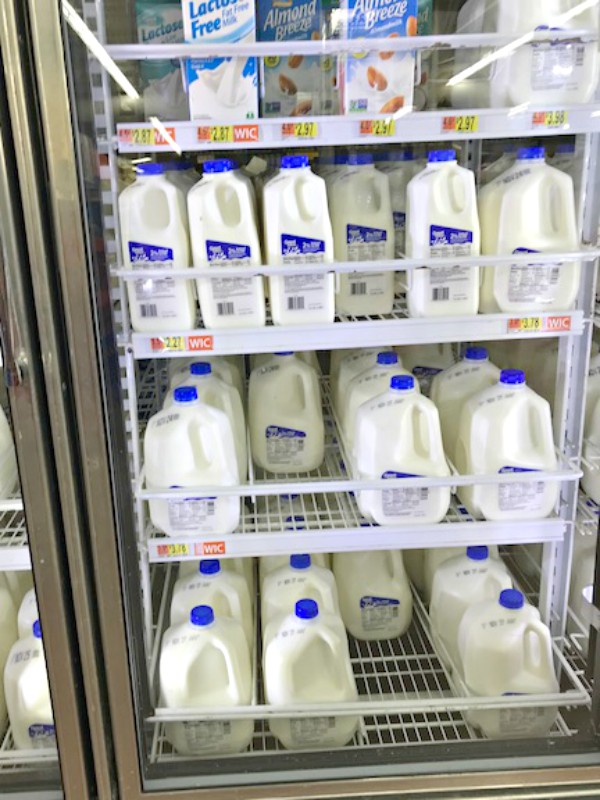
Identify the location of jug handles bottom shelf. (232, 660), (234, 600), (240, 564), (321, 558), (398, 572), (325, 589), (333, 642), (498, 578), (542, 628).